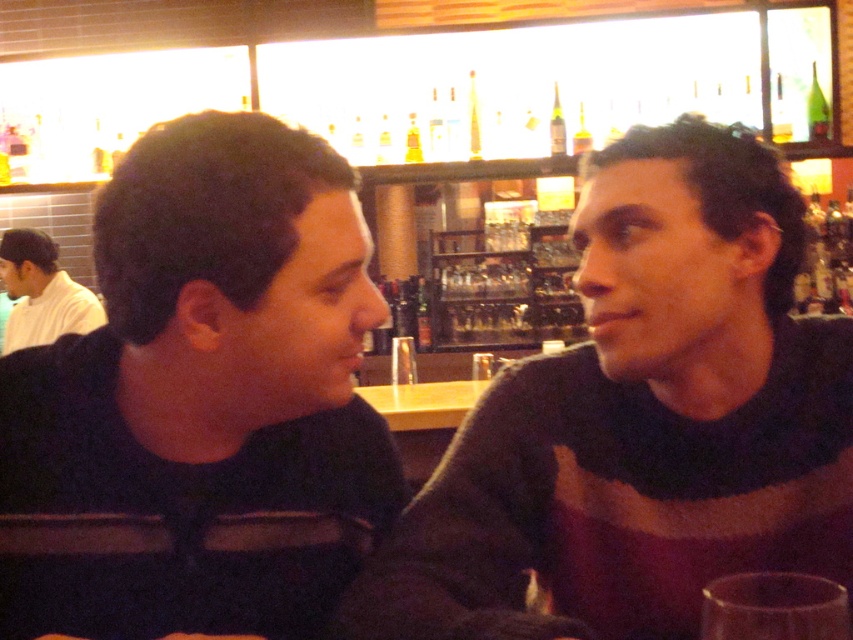
Is dark blue sweater at left to the right of white matte shirt at upper left from the viewer's perspective?

Indeed, dark blue sweater at left is positioned on the right side of white matte shirt at upper left.

Can you confirm if dark blue sweater at left is smaller than white matte shirt at upper left?

Correct, dark blue sweater at left occupies less space than white matte shirt at upper left.

Who is more forward, [186,332] or [61,280]?

Point [186,332] is more forward.

The image size is (853, 640). I want to click on dark blue sweater at left, so click(x=202, y=388).

Does dark brown sweater at center have a larger size compared to white matte shirt at upper left?

No, dark brown sweater at center is not bigger than white matte shirt at upper left.

The width and height of the screenshot is (853, 640). I want to click on dark brown sweater at center, so click(641, 420).

Between point (535, 573) and point (38, 342), which one is positioned in front?

Point (535, 573) is more forward.

The height and width of the screenshot is (640, 853). Identify the location of dark brown sweater at center. (641, 420).

How distant is dark brown sweater at center from dark blue sweater at left?

dark brown sweater at center and dark blue sweater at left are 24.16 centimeters apart.

Does dark brown sweater at center have a smaller size compared to dark blue sweater at left?

Actually, dark brown sweater at center might be larger than dark blue sweater at left.

The width and height of the screenshot is (853, 640). What do you see at coordinates (641, 420) in the screenshot?
I see `dark brown sweater at center` at bounding box center [641, 420].

Find the location of a particular element. The width and height of the screenshot is (853, 640). dark brown sweater at center is located at coordinates (641, 420).